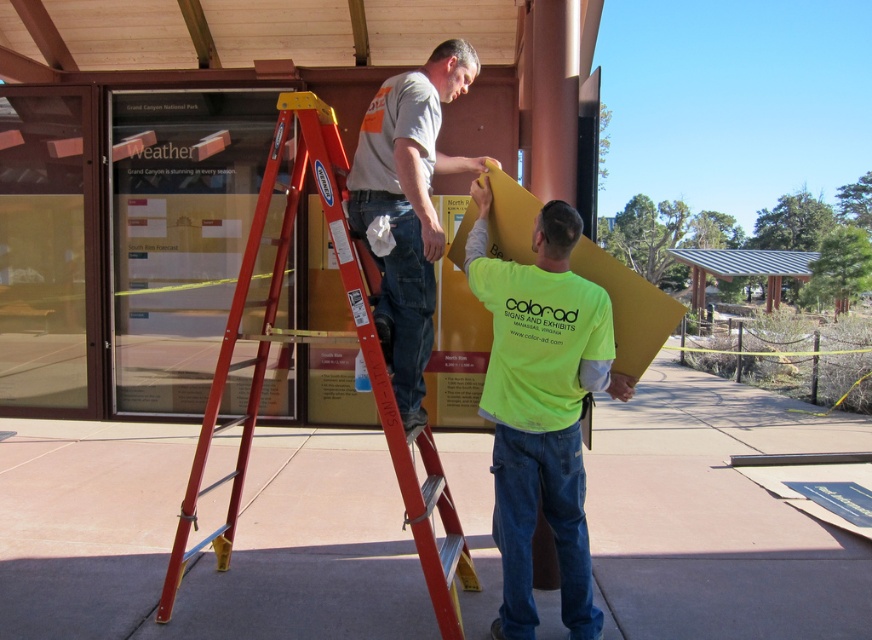
Who is lower down, neon yellow shirt at center or red metal ladder at center?

neon yellow shirt at center is lower down.

What are the coordinates of `neon yellow shirt at center` in the screenshot? It's located at (542, 406).

Does point (503, 381) lie behind point (423, 556)?

Yes, point (503, 381) is farther from viewer.

Locate an element on the screen. The image size is (872, 640). neon yellow shirt at center is located at coordinates (542, 406).

Does red metal ladder at center have a larger size compared to matte gray shirt at center?

Correct, red metal ladder at center is larger in size than matte gray shirt at center.

The height and width of the screenshot is (640, 872). What are the coordinates of `red metal ladder at center` in the screenshot? It's located at (327, 348).

Between point (304, 342) and point (356, 147), which one is positioned behind?

The point (304, 342) is more distant.

This screenshot has width=872, height=640. Find the location of `red metal ladder at center`. red metal ladder at center is located at coordinates (327, 348).

Between point (518, 428) and point (378, 104), which one is positioned in front?

Positioned in front is point (378, 104).

Is point (542, 349) more distant than point (441, 154)?

No, it is in front of (441, 154).

The image size is (872, 640). I want to click on neon yellow shirt at center, so click(542, 406).